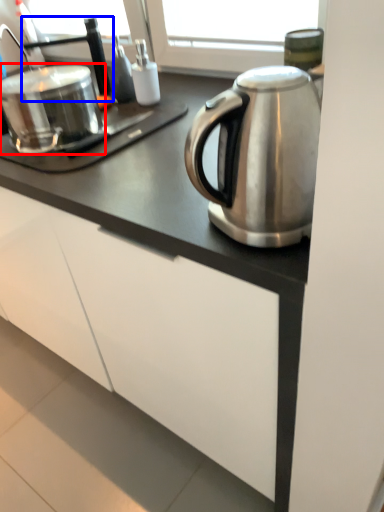
Question: Among these objects, which one is nearest to the camera, appliance (highlighted by a red box) or faucet (highlighted by a blue box)?

Choices:
 (A) appliance
 (B) faucet

Answer: (A)